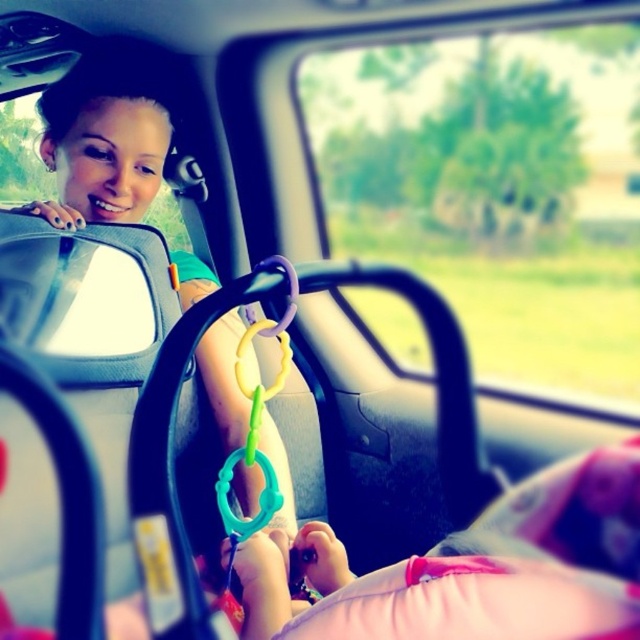
You are a delivery person trying to hand a package to someone inside the car. The car window is partially open. If you stand directly in front of the transparent glass car window at center, will you be able to reach the matte black hair at upper left to hand over the package?

The distance between the transparent glass car window at center and the matte black hair at upper left is 32.08 inches, so if the delivery person can extend their arm 32.08 inches, they can reach the matte black hair at upper left to hand over the package.

You are a passenger in the car and want to look outside through the transparent glass car window at center. Where exactly should you look to see the outside view?

The transparent glass car window at center is located at point (497, 189), so you should look there to see the outside view.